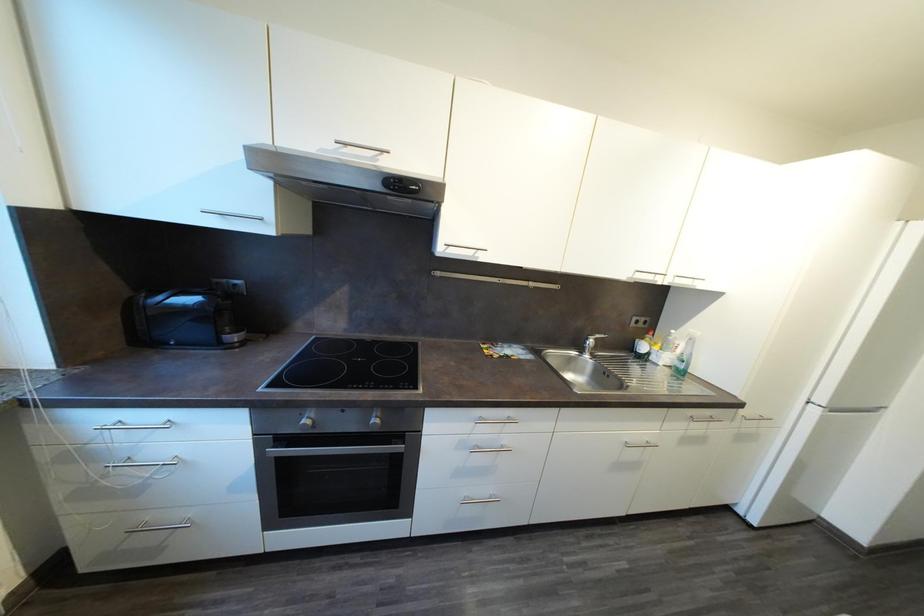
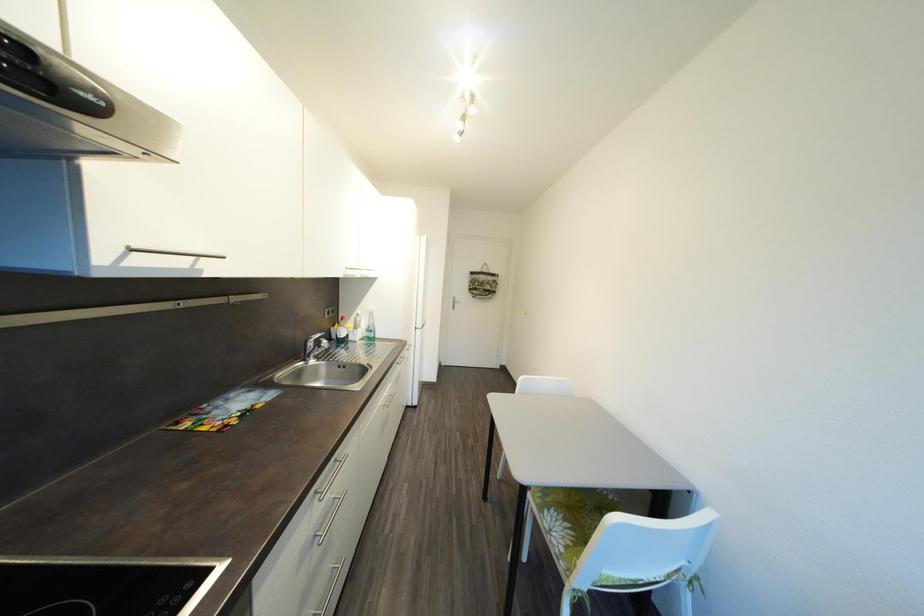
Question: Based on the continuous images, in which direction is the camera rotating? Reply with the corresponding letter.

Choices:
 (A) Left
 (B) Right
 (C) Up
 (D) Down

Answer: (B)